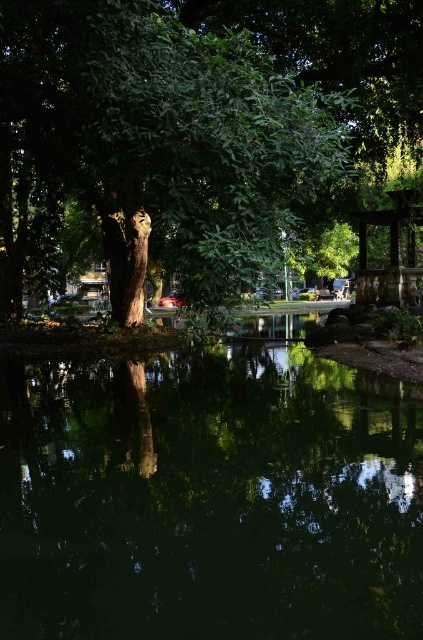
You are planning to place a small wooden boat in the park scene. The boat requires a water area wider than the green leafy tree at center to navigate comfortably. Based on the scene description, will the green reflective water at center provide enough space for the boat?

The green reflective water at center has a width less than the green leafy tree at center, so it will not provide enough space for the boat that requires a water area wider than the tree.